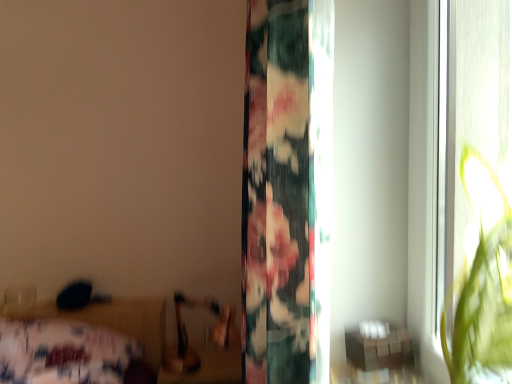
Question: From their relative heights in the image, would you say floral fabric curtain at center is taller or shorter than floral fabric bed at lower left?

Choices:
 (A) tall
 (B) short

Answer: (A)

Question: In the image, is floral fabric curtain at center positioned in front of or behind floral fabric bed at lower left?

Choices:
 (A) front
 (B) behind

Answer: (A)

Question: Which object is positioned farthest from the floral fabric bed at lower left?

Choices:
 (A) wooden table at lower right
 (B) floral fabric curtain at center

Answer: (A)

Question: Estimate the real-world distances between objects in this image. Which object is closer to the floral fabric curtain at center?

Choices:
 (A) wooden table at lower right
 (B) floral fabric bed at lower left

Answer: (A)